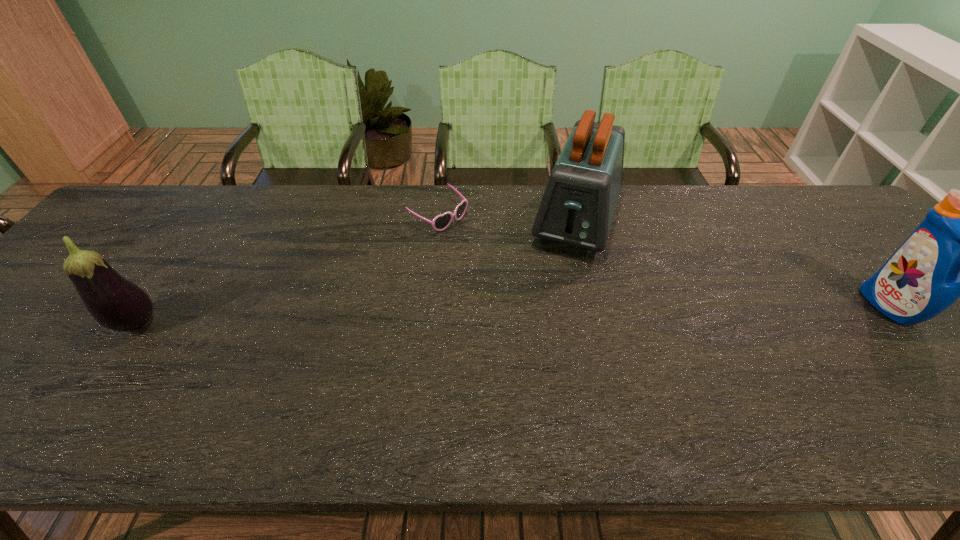
Where is `vacant space that's between the rightmost object and the eggplant`? vacant space that's between the rightmost object and the eggplant is located at coordinates pyautogui.click(x=514, y=316).

You are a GUI agent. You are given a task and a screenshot of the screen. Output one action in this format:
    pyautogui.click(x=<x>, y=<y>)
    Task: Click on the free space between the eggplant and the rightmost object
    
    Given the screenshot: What is the action you would take?
    pyautogui.click(x=514, y=316)

Locate an element on the screen. Image resolution: width=960 pixels, height=540 pixels. object that is the second closest one to the eggplant is located at coordinates (577, 208).

You are a GUI agent. You are given a task and a screenshot of the screen. Output one action in this format:
    pyautogui.click(x=<x>, y=<y>)
    Task: Click on the object that is the second closest one to the toaster
    
    Given the screenshot: What is the action you would take?
    pyautogui.click(x=959, y=250)

Locate an element on the screen. The height and width of the screenshot is (540, 960). free point that satisfies the following two spatial constraints: 1. on the back side of the shortest object; 2. on the right side of the eggplant is located at coordinates (210, 217).

Find the location of `vacant space that satisfies the following two spatial constraints: 1. on the front side of the toaster; 2. on the right side of the shortest object`. vacant space that satisfies the following two spatial constraints: 1. on the front side of the toaster; 2. on the right side of the shortest object is located at coordinates (438, 221).

Find the location of `free location that satisfies the following two spatial constraints: 1. on the front side of the detergent; 2. on the label of the shortest object`. free location that satisfies the following two spatial constraints: 1. on the front side of the detergent; 2. on the label of the shortest object is located at coordinates (429, 307).

Where is `free point that satisfies the following two spatial constraints: 1. on the front side of the second object from right to left; 2. on the right side of the shortest object`? free point that satisfies the following two spatial constraints: 1. on the front side of the second object from right to left; 2. on the right side of the shortest object is located at coordinates (438, 221).

This screenshot has height=540, width=960. What are the coordinates of `vacant region that satisfies the following two spatial constraints: 1. on the front side of the second object from left to right; 2. on the label of the detergent` in the screenshot? It's located at (429, 307).

Where is `vacant area in the image that satisfies the following two spatial constraints: 1. on the back side of the eggplant; 2. on the label of the rightmost object`? The width and height of the screenshot is (960, 540). vacant area in the image that satisfies the following two spatial constraints: 1. on the back side of the eggplant; 2. on the label of the rightmost object is located at coordinates (149, 307).